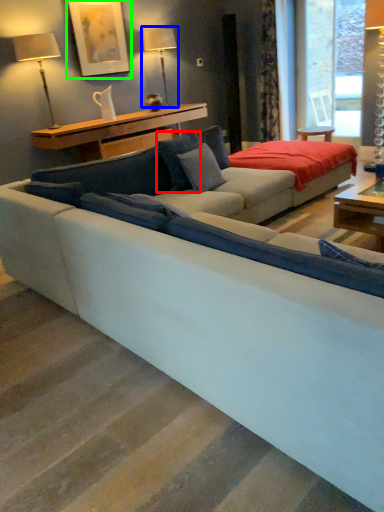
Question: Which is nearer to the pillow (highlighted by a red box)? table lamp (highlighted by a blue box) or picture frame (highlighted by a green box).

Choices:
 (A) table lamp
 (B) picture frame

Answer: (B)